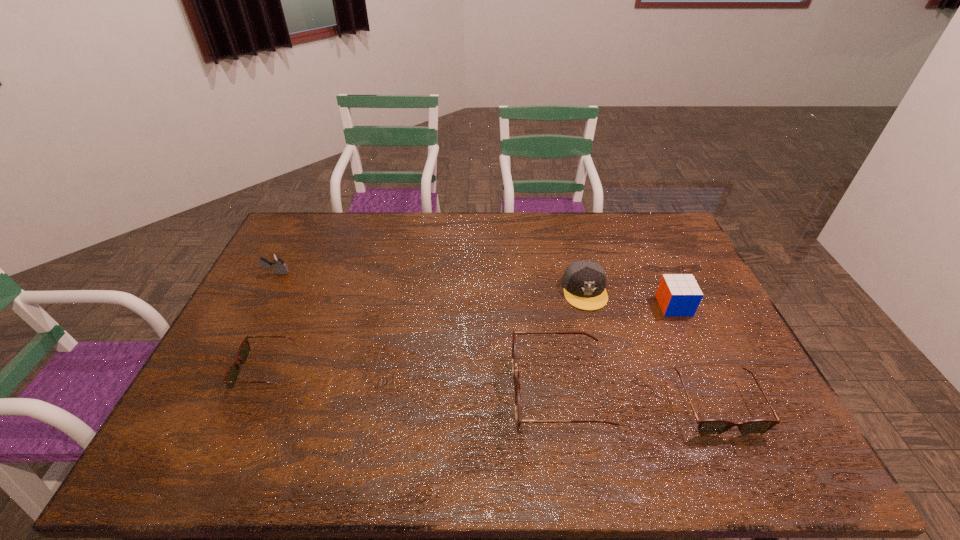
Identify the location of free space that is in between the second spectacles from left to right and the cube. [616, 349].

Identify the location of vacant space in between the second spectacles from left to right and the cube. (616, 349).

You are a GUI agent. You are given a task and a screenshot of the screen. Output one action in this format:
    pyautogui.click(x=<x>, y=<y>)
    Task: Click on the vacant space in between the shortest object and the cap
    Image resolution: width=960 pixels, height=540 pixels.
    Given the screenshot: What is the action you would take?
    pyautogui.click(x=425, y=330)

This screenshot has height=540, width=960. I want to click on empty space between the leftmost spectacles and the cap, so click(425, 330).

Locate an element on the screen. unoccupied area between the cap and the second tallest spectacles is located at coordinates (650, 348).

Locate an element on the screen. Image resolution: width=960 pixels, height=540 pixels. object identified as the second closest to the second tallest spectacles is located at coordinates (678, 294).

This screenshot has width=960, height=540. Identify the location of object that can be found as the fifth closest to the cap. (277, 262).

Find the location of a particular element. The width and height of the screenshot is (960, 540). spectacles that stands as the second closest to the leftmost spectacles is located at coordinates (710, 427).

Locate which spectacles ranks in proximity to the fifth tallest object. Please provide its 2D coordinates. Your answer should be formatted as a tuple, i.e. [(x, y)], where the tuple contains the x and y coordinates of a point satisfying the conditions above.

[(519, 420)]

Identify the location of vacant space that satisfies the following two spatial constraints: 1. on the front side of the cube; 2. at the front view of the shortest spectacles. (703, 369).